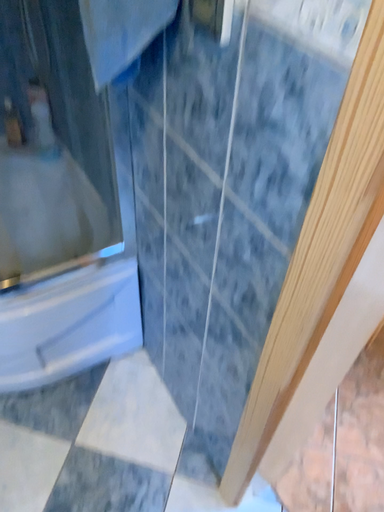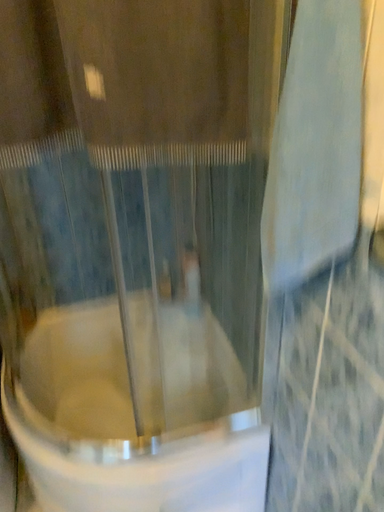
Question: Which way did the camera rotate in the video?

Choices:
 (A) rotated upward
 (B) rotated downward

Answer: (A)